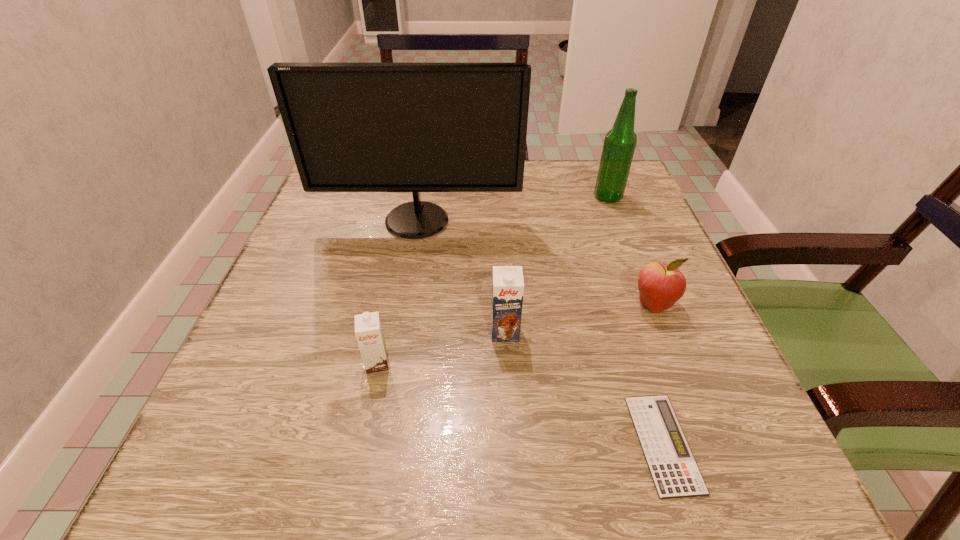
This screenshot has width=960, height=540. What are the coordinates of `the tallest object` in the screenshot? It's located at (352, 127).

The image size is (960, 540). Identify the location of beer bottle. [619, 145].

You are a GUI agent. You are given a task and a screenshot of the screen. Output one action in this format:
    pyautogui.click(x=<x>, y=<y>)
    Task: Click on the taller chocolate milk
    The width and height of the screenshot is (960, 540).
    Given the screenshot: What is the action you would take?
    pyautogui.click(x=508, y=285)

Identify the location of the farther chocolate milk. The height and width of the screenshot is (540, 960). (508, 285).

Where is `apple`? The image size is (960, 540). apple is located at coordinates (660, 285).

Locate an element on the screen. the left chocolate milk is located at coordinates pyautogui.click(x=368, y=330).

Find the location of a particular element. This screenshot has width=960, height=540. the nearer chocolate milk is located at coordinates (368, 330).

The width and height of the screenshot is (960, 540). In order to click on the nearest object in this screenshot , I will do `click(675, 473)`.

Identify the location of calculator. The image size is (960, 540). (675, 473).

Find the location of a particular element. The width and height of the screenshot is (960, 540). blank space located on the front-facing side of the tallest object is located at coordinates (390, 375).